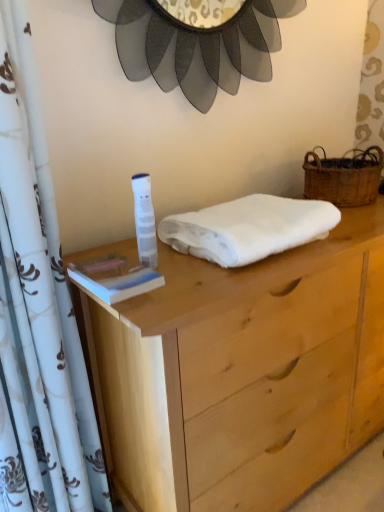
Question: Is white floral fabric curtain at left positioned far away from white soft towel at center?

Choices:
 (A) no
 (B) yes

Answer: (A)

Question: Does white floral fabric curtain at left lie in front of white soft towel at center?

Choices:
 (A) yes
 (B) no

Answer: (A)

Question: Does white floral fabric curtain at left touch white soft towel at center?

Choices:
 (A) no
 (B) yes

Answer: (A)

Question: Can you confirm if white floral fabric curtain at left is wider than white soft towel at center?

Choices:
 (A) yes
 (B) no

Answer: (B)

Question: From a real-world perspective, is white floral fabric curtain at left located higher than white soft towel at center?

Choices:
 (A) no
 (B) yes

Answer: (A)

Question: Could white soft towel at center be considered to be inside white floral fabric curtain at left?

Choices:
 (A) no
 (B) yes

Answer: (A)

Question: Is natural wood chest of drawers at center at the right side of white plastic tube at center?

Choices:
 (A) yes
 (B) no

Answer: (A)

Question: Is natural wood chest of drawers at center not close to white plastic tube at center?

Choices:
 (A) no
 (B) yes

Answer: (A)

Question: From the image's perspective, would you say natural wood chest of drawers at center is shown under white plastic tube at center?

Choices:
 (A) no
 (B) yes

Answer: (B)

Question: Does natural wood chest of drawers at center have a greater width compared to white plastic tube at center?

Choices:
 (A) no
 (B) yes

Answer: (B)

Question: Does natural wood chest of drawers at center lie behind white plastic tube at center?

Choices:
 (A) yes
 (B) no

Answer: (B)

Question: Is white plastic tube at center at the back of natural wood chest of drawers at center?

Choices:
 (A) yes
 (B) no

Answer: (B)

Question: Would you say white floral fabric curtain at left is part of white soft towel at center's contents?

Choices:
 (A) no
 (B) yes

Answer: (A)